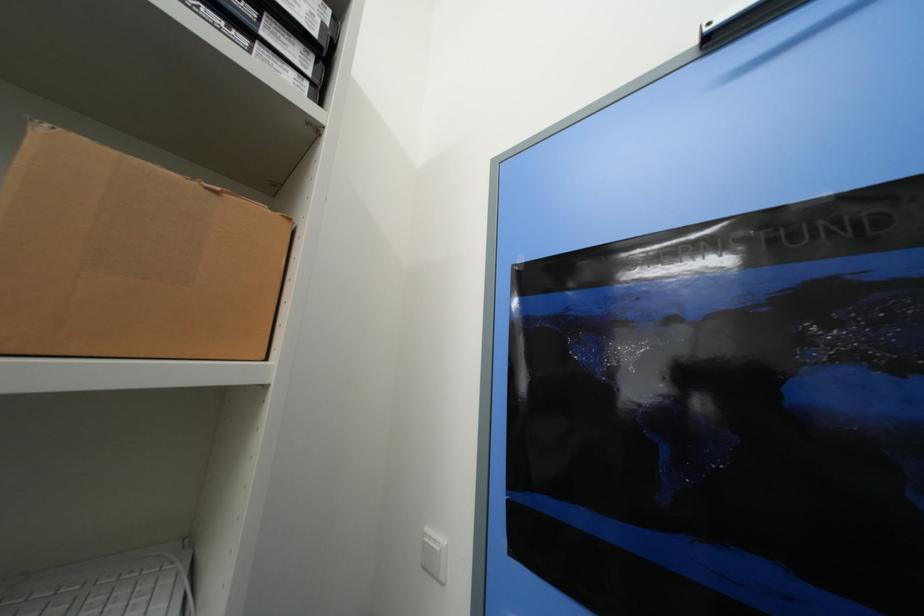
Image resolution: width=924 pixels, height=616 pixels. What do you see at coordinates (433, 554) in the screenshot?
I see `a white light switch` at bounding box center [433, 554].